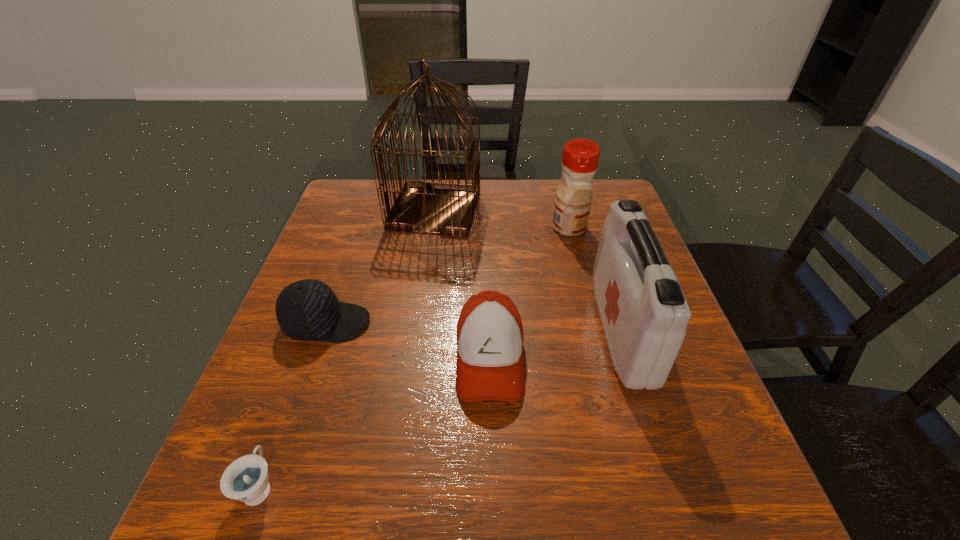
The width and height of the screenshot is (960, 540). In order to click on vacant area at the far right corner in this screenshot , I will do `click(618, 183)`.

At what (x,y) coordinates should I click in order to perform the action: click on blank space at the near right corner of the desktop. Please return your answer as a coordinate pair (x, y). Looking at the image, I should click on (675, 478).

Locate an element on the screen. The width and height of the screenshot is (960, 540). empty location between the right baseball cap and the left baseball cap is located at coordinates (408, 341).

Image resolution: width=960 pixels, height=540 pixels. Find the location of `unoccupied area between the nearest object and the birdcage`. unoccupied area between the nearest object and the birdcage is located at coordinates pos(348,348).

Locate an element on the screen. This screenshot has height=540, width=960. unoccupied area between the first-aid kit and the teacup is located at coordinates coord(440,409).

Find the location of a particular element. vacant area that lies between the first-aid kit and the right baseball cap is located at coordinates (555, 345).

You are a GUI agent. You are given a task and a screenshot of the screen. Output one action in this format:
    pyautogui.click(x=<x>, y=<y>)
    Task: Click on the unoccupied area between the condiment and the right baseball cap
    
    Given the screenshot: What is the action you would take?
    pyautogui.click(x=530, y=293)

At what (x,y) coordinates should I click in order to perform the action: click on empty space that is in between the left baseball cap and the birdcage. Please return your answer as a coordinate pair (x, y). This screenshot has width=960, height=540. Looking at the image, I should click on (381, 267).

At what (x,y) coordinates should I click in order to perform the action: click on vacant region between the first-aid kit and the right baseball cap. Please return your answer as a coordinate pair (x, y). This screenshot has height=540, width=960. Looking at the image, I should click on (555, 345).

Locate an element on the screen. The width and height of the screenshot is (960, 540). free space between the nearest object and the first-aid kit is located at coordinates (440, 409).